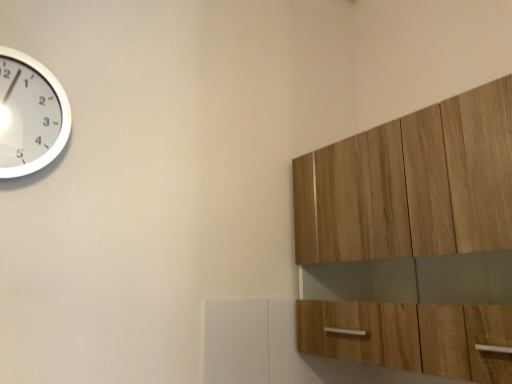
What do you see at coordinates (412, 184) in the screenshot? I see `light wood cabinet at upper right` at bounding box center [412, 184].

Image resolution: width=512 pixels, height=384 pixels. I want to click on light wood cabinet at upper right, so tap(412, 184).

This screenshot has width=512, height=384. Describe the element at coordinates (30, 115) in the screenshot. I see `white metallic clock at upper left` at that location.

Locate an element on the screen. This screenshot has width=512, height=384. white metallic clock at upper left is located at coordinates (30, 115).

Measure the distance between point (27, 62) and camera.

36.34 inches.

What is the approximate height of white metallic clock at upper left?

The height of white metallic clock at upper left is 29.07 centimeters.

Identify the location of light wood cabinet at upper right. (412, 184).

Which is more to the left, light wood cabinet at upper right or white metallic clock at upper left?

white metallic clock at upper left is more to the left.

In the image, is light wood cabinet at upper right positioned in front of or behind white metallic clock at upper left?

light wood cabinet at upper right is positioned closer to the viewer than white metallic clock at upper left.

Which is farther from the camera, [379,257] or [37,79]?

The point [379,257] is behind.

From the image's perspective, which one is positioned higher, light wood cabinet at upper right or white metallic clock at upper left?

white metallic clock at upper left, from the image's perspective.

From a real-world perspective, which object rests below the other?

light wood cabinet at upper right is physically lower.

Which of these two, light wood cabinet at upper right or white metallic clock at upper left, is wider?

Wider between the two is light wood cabinet at upper right.

Considering the sizes of objects light wood cabinet at upper right and white metallic clock at upper left in the image provided, who is taller, light wood cabinet at upper right or white metallic clock at upper left?

light wood cabinet at upper right.

Considering the relative sizes of light wood cabinet at upper right and white metallic clock at upper left in the image provided, is light wood cabinet at upper right bigger than white metallic clock at upper left?

Indeed, light wood cabinet at upper right has a larger size compared to white metallic clock at upper left.

Is light wood cabinet at upper right spatially inside white metallic clock at upper left, or outside of it?

light wood cabinet at upper right lies outside white metallic clock at upper left.

Is light wood cabinet at upper right next to white metallic clock at upper left?

No, light wood cabinet at upper right is not beside white metallic clock at upper left.

Is light wood cabinet at upper right facing towards white metallic clock at upper left?

Yes, light wood cabinet at upper right is aimed at white metallic clock at upper left.

How different are the orientations of light wood cabinet at upper right and white metallic clock at upper left in degrees?

88.4 degrees.

Locate an element on the screen. wall clock that appears above the light wood cabinet at upper right (from the image's perspective) is located at coordinates (30, 115).

Which object is positioned more to the left, white metallic clock at upper left or light wood cabinet at upper right?

white metallic clock at upper left is more to the left.

Is white metallic clock at upper left behind light wood cabinet at upper right?

Yes, white metallic clock at upper left is further from the camera.

Which point is more forward, (60, 130) or (297, 313)?

The point (60, 130) is closer.

From the image's perspective, is white metallic clock at upper left over light wood cabinet at upper right?

Yes, from the image's perspective, white metallic clock at upper left is on top of light wood cabinet at upper right.

From a real-world perspective, is white metallic clock at upper left physically located above or below light wood cabinet at upper right?

Clearly, from a real-world perspective, white metallic clock at upper left is above light wood cabinet at upper right.

In the scene shown: Which of these two, white metallic clock at upper left or light wood cabinet at upper right, is wider?

With larger width is light wood cabinet at upper right.

Considering the sizes of objects white metallic clock at upper left and light wood cabinet at upper right in the image provided, who is taller, white metallic clock at upper left or light wood cabinet at upper right?

light wood cabinet at upper right.

Looking at the image, does white metallic clock at upper left seem bigger or smaller compared to light wood cabinet at upper right?

In the image, white metallic clock at upper left appears to be smaller than light wood cabinet at upper right.

Is light wood cabinet at upper right located within white metallic clock at upper left?

No.

Are white metallic clock at upper left and light wood cabinet at upper right located far from each other?

No.

Is white metallic clock at upper left facing away from light wood cabinet at upper right?

white metallic clock at upper left is not turned away from light wood cabinet at upper right.

This screenshot has height=384, width=512. In order to click on cabinetry on the right of white metallic clock at upper left in this screenshot , I will do `click(412, 184)`.

Find the location of a particular element. Image resolution: width=512 pixels, height=384 pixels. wall clock that appears on the left of light wood cabinet at upper right is located at coordinates (30, 115).

The height and width of the screenshot is (384, 512). I want to click on cabinetry beneath the white metallic clock at upper left (from a real-world perspective), so click(x=412, y=184).